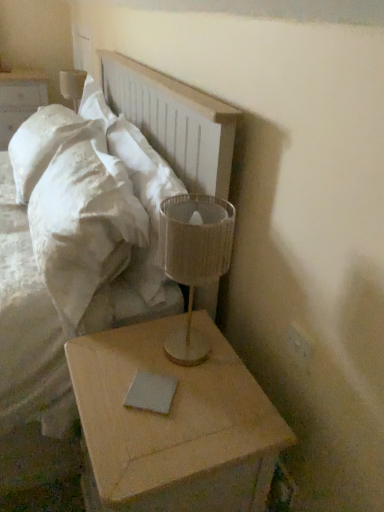
Question: Is light wood/roughnightstand at lower right, which is the second nightstand from back to front, smaller than white matte nightstand at upper left, which appears as the second nightstand when ordered from the bottom?

Choices:
 (A) no
 (B) yes

Answer: (B)

Question: Is light wood/roughnightstand at lower right, the second nightstand in the top-to-bottom sequence, far from white matte nightstand at upper left, which appears as the second nightstand when ordered from the bottom?

Choices:
 (A) yes
 (B) no

Answer: (A)

Question: Is white matte nightstand at upper left, acting as the first nightstand starting from the back, inside light wood/roughnightstand at lower right, arranged as the second nightstand when viewed from the left?

Choices:
 (A) yes
 (B) no

Answer: (B)

Question: From the image's perspective, does light wood/roughnightstand at lower right, arranged as the second nightstand when viewed from the left, appear lower than white matte nightstand at upper left, acting as the first nightstand starting from the back?

Choices:
 (A) yes
 (B) no

Answer: (A)

Question: From the image's perspective, is light wood/roughnightstand at lower right, which is the first nightstand from bottom to top, above white matte nightstand at upper left, which is counted as the first nightstand, starting from the top?

Choices:
 (A) no
 (B) yes

Answer: (A)

Question: Is light wood/roughnightstand at lower right, the second nightstand in the top-to-bottom sequence, positioned beyond the bounds of white matte nightstand at upper left, which ranks as the second nightstand in front-to-back order?

Choices:
 (A) no
 (B) yes

Answer: (B)

Question: Is translucent fabric lampshade at right, which is counted as the 2th table lamp, starting from the back, aimed at white soft pillow at upper left?

Choices:
 (A) yes
 (B) no

Answer: (B)

Question: From a real-world perspective, is translucent fabric lampshade at right, the second table lamp positioned from the left, located beneath white soft pillow at upper left?

Choices:
 (A) yes
 (B) no

Answer: (B)

Question: Considering the relative sizes of translucent fabric lampshade at right, which is counted as the 1th table lamp, starting from the front, and white soft pillow at upper left in the image provided, is translucent fabric lampshade at right, which is counted as the 1th table lamp, starting from the front, taller than white soft pillow at upper left?

Choices:
 (A) yes
 (B) no

Answer: (B)

Question: Is translucent fabric lampshade at right, the second table lamp positioned from the left, outside white soft pillow at upper left?

Choices:
 (A) no
 (B) yes

Answer: (B)

Question: Can you confirm if translucent fabric lampshade at right, the second table lamp positioned from the left, is shorter than white soft pillow at upper left?

Choices:
 (A) yes
 (B) no

Answer: (A)

Question: Can you confirm if translucent fabric lampshade at right, arranged as the 1th table lamp when viewed from the right, is bigger than white soft pillow at upper left?

Choices:
 (A) no
 (B) yes

Answer: (A)

Question: Is translucent fabric lampshade at right, which is counted as the 2th table lamp, starting from the back, taller than white matte nightstand at upper left, which ranks as the second nightstand in front-to-back order?

Choices:
 (A) yes
 (B) no

Answer: (B)